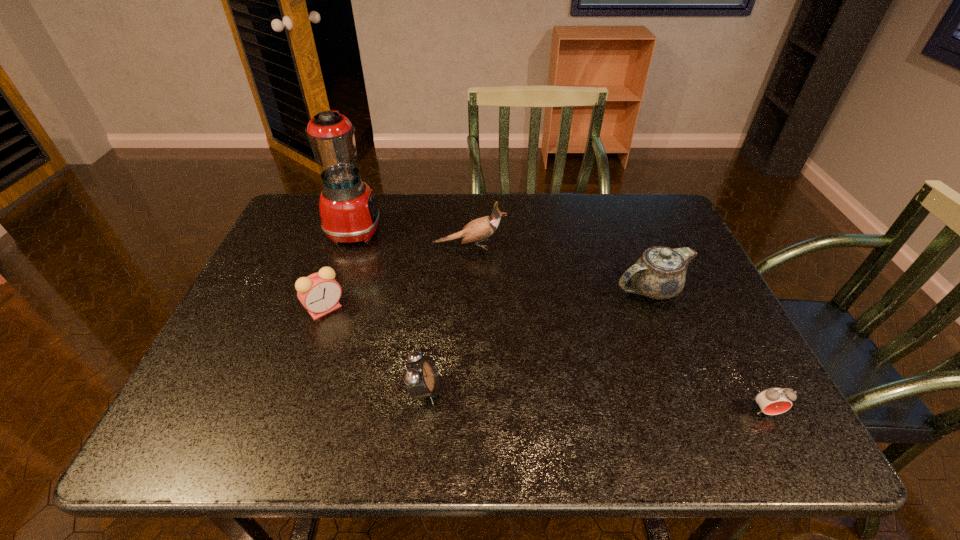
Where is `the tallest object`? The height and width of the screenshot is (540, 960). the tallest object is located at coordinates (349, 214).

Where is `bird`? This screenshot has width=960, height=540. bird is located at coordinates (481, 228).

What are the coordinates of `the fifth object from left to right` in the screenshot? It's located at (659, 273).

This screenshot has width=960, height=540. I want to click on the leftmost alarm clock, so click(319, 293).

Locate an element on the screen. the second alarm clock from right to left is located at coordinates pyautogui.click(x=421, y=376).

This screenshot has width=960, height=540. Identify the location of the rightmost object. (772, 401).

Locate an element on the screen. the shortest alarm clock is located at coordinates (772, 401).

Find the location of a particular element. This screenshot has width=960, height=540. free space located on the controls of the food processor is located at coordinates (429, 230).

I want to click on vacant space located at the face of the bird, so click(x=569, y=245).

Where is `free region located 0.240m from the spout of the chinaware`? This screenshot has height=540, width=960. free region located 0.240m from the spout of the chinaware is located at coordinates (518, 289).